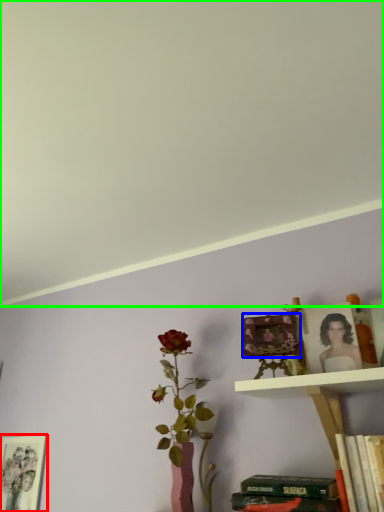
Question: Estimate the real-world distances between objects in this image. Which object is closer to picture frame (highlighted by a red box), picture frame (highlighted by a blue box) or backdrop (highlighted by a green box)?

Choices:
 (A) picture frame
 (B) backdrop

Answer: (A)